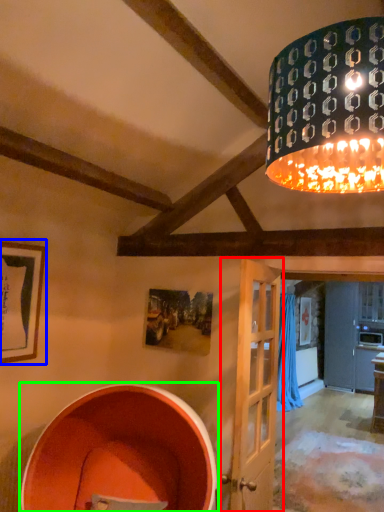
Question: Considering the real-world distances, which object is closest to door (highlighted by a red box)? picture frame (highlighted by a blue box) or barrel (highlighted by a green box).

Choices:
 (A) picture frame
 (B) barrel

Answer: (B)